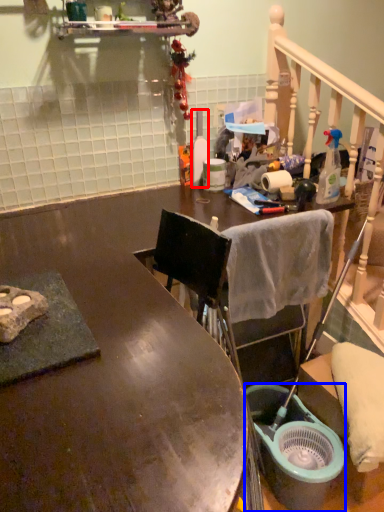
Question: Which object is further to the camera taking this photo, bottle (highlighted by a red box) or bucket (highlighted by a blue box)?

Choices:
 (A) bottle
 (B) bucket

Answer: (A)